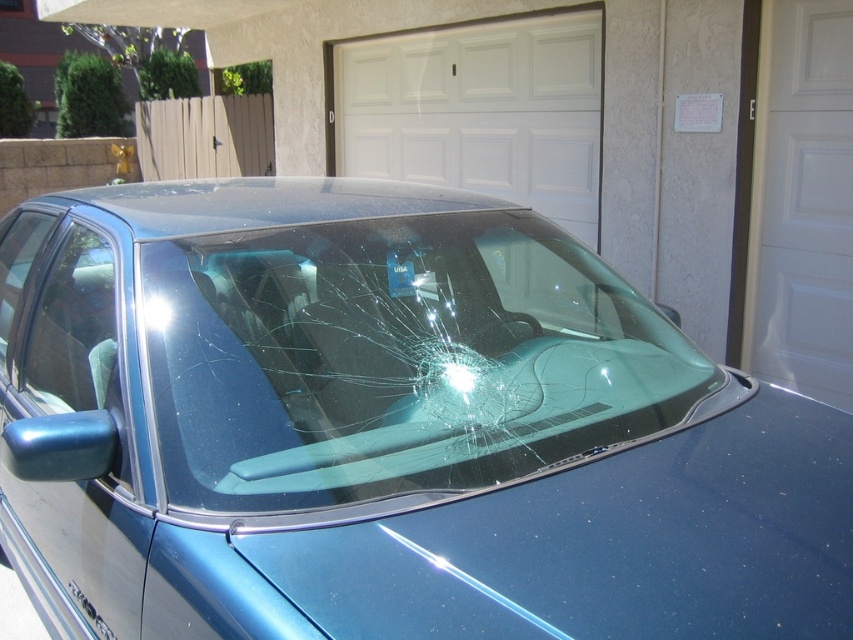
You are a technician inspecting the damaged windshield. You notice two points of impact on the windshield. The first point is at coordinates point [447,234] and the second is at point [415,52]. Which point is closer to you?

Point [447,234] is closer to the viewer than point [415,52].

From the picture: You are a mechanic assessing damage to a car. You notice the glossy blue car at center and the transparent glass windshield at center. Which object is positioned to the left from your viewpoint?

The glossy blue car at center is to the left of the transparent glass windshield at center, so the glossy blue car at center is positioned to the left.

Based on the photo, you are standing 5 feet away from the car windshield. A point at coordinate (718, 580) on the windshield is where you want to place a sticker. Can you safely reach that point without moving closer than your current position?

The point at coordinate (718, 580) on the windshield is 4.63 feet away from you. Since you are currently standing 5 feet away, you are too far to reach it without moving closer.